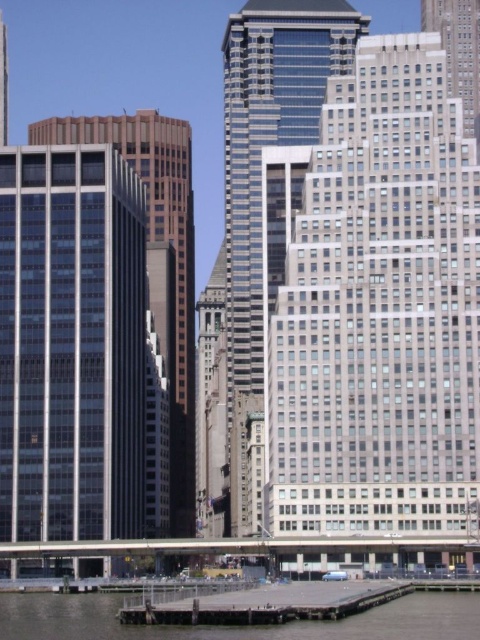
You are a photographer planning to take a wide shot of the waterfront scene. You want to include both the wooden dock at lower center and the smooth brown building at left in your frame. Which object should you focus on first to ensure both are captured clearly?

The wooden dock at lower center is smaller than the smooth brown building at left, so you should focus on the smooth brown building at left first since it is larger and more prominent in the scene.

You are standing at the point marked by the coordinates (x=375, y=307) in the image. Looking around, you see a glassy steel skyscraper at center. What is the nearest object to your current position?

The nearest object to the point marked by the coordinates (x=375, y=307) is the glassy steel skyscraper at center, as the point marks its location.

You are a photographer standing on the dock and want to capture both the glassy steel skyscraper at center and the glassy reflective skyscraper at center in a single shot. Since the dock is only 3 meters wide, will you be able to fit both structures into the frame without moving your position?

The glassy steel skyscraper at center is below the glassy reflective skyscraper at center, so they are vertically aligned. Since the dock is only 3 meters wide, you can still capture both in a single shot as they occupy different vertical spaces rather than horizontal space.